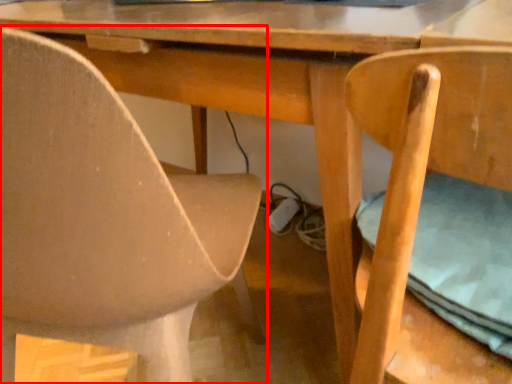
Question: Considering the relative positions of chair (annotated by the red box) and chair in the image provided, where is chair (annotated by the red box) located with respect to the staircase?

Choices:
 (A) right
 (B) left

Answer: (B)